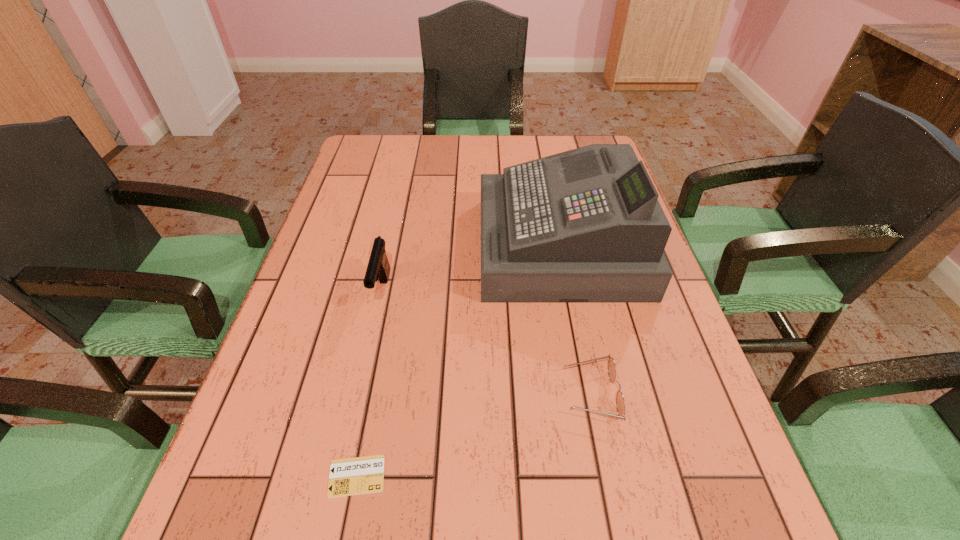
Find the location of a particular element. The width and height of the screenshot is (960, 540). vacant space at the near right corner is located at coordinates (658, 538).

The width and height of the screenshot is (960, 540). Identify the location of vacant area that lies between the tallest object and the second nearest object. (576, 320).

Where is `free space between the cash register and the spectacles`? free space between the cash register and the spectacles is located at coordinates (576, 320).

I want to click on empty space that is in between the spectacles and the identity card, so point(474,435).

In order to click on free space between the shortest object and the tallest object in this screenshot , I will do `click(459, 361)`.

Locate an element on the screen. free point between the shortest object and the tallest object is located at coordinates (459, 361).

Where is `free space between the pistol and the tallest object`? This screenshot has height=540, width=960. free space between the pistol and the tallest object is located at coordinates (471, 269).

The image size is (960, 540). What are the coordinates of `free space between the second nearest object and the identity card` in the screenshot? It's located at (474, 435).

Locate an element on the screen. vacant space in between the pistol and the tallest object is located at coordinates (471, 269).

Where is `free space between the nearest object and the cash register`? This screenshot has height=540, width=960. free space between the nearest object and the cash register is located at coordinates click(459, 361).